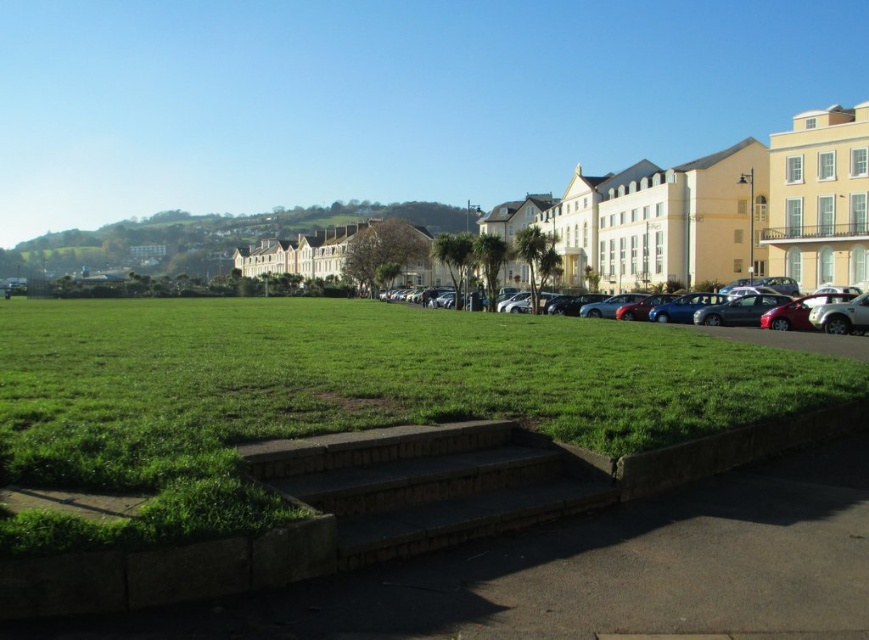
Question: Estimate the real-world distances between objects in this image. Which object is closer to the smooth concrete steps at center?

Choices:
 (A) brown stone stairs at center
 (B) metallic silver car at center
 (C) green grass at center

Answer: (A)

Question: Which of these objects is positioned farthest from the brown stone stairs at center?

Choices:
 (A) smooth concrete steps at center
 (B) metallic silver car at center

Answer: (B)

Question: Among these points, which one is farthest from the camera?

Choices:
 (A) (788, 305)
 (B) (408, 412)
 (C) (473, 456)
 (D) (694, 589)

Answer: (A)

Question: Is smooth concrete steps at center above metallic silver car at center?

Choices:
 (A) no
 (B) yes

Answer: (A)

Question: Is green grass at center to the left of metallic silver car at center from the viewer's perspective?

Choices:
 (A) yes
 (B) no

Answer: (A)

Question: Is green grass at center thinner than smooth concrete steps at center?

Choices:
 (A) no
 (B) yes

Answer: (A)